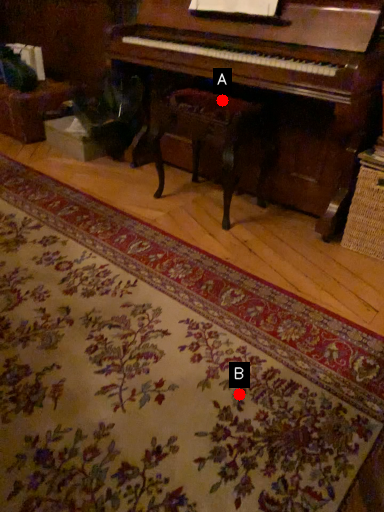
Question: Two points are circled on the image, labeled by A and B beside each circle. Among these points, which one is nearest to the camera?

Choices:
 (A) A is closer
 (B) B is closer

Answer: (B)